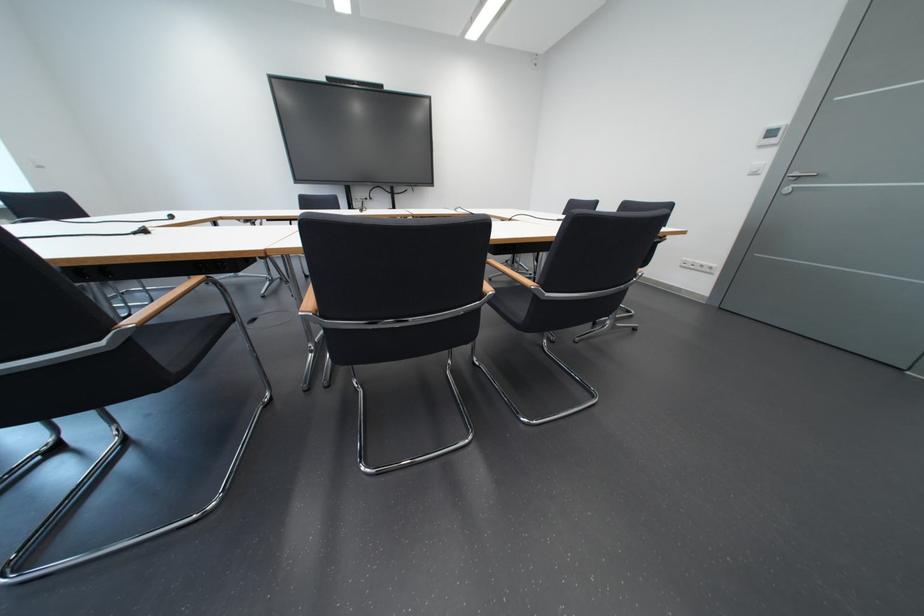
Find where to turn the silver door handle. Please return your answer as a coordinate pair (x, y).

(796, 180)